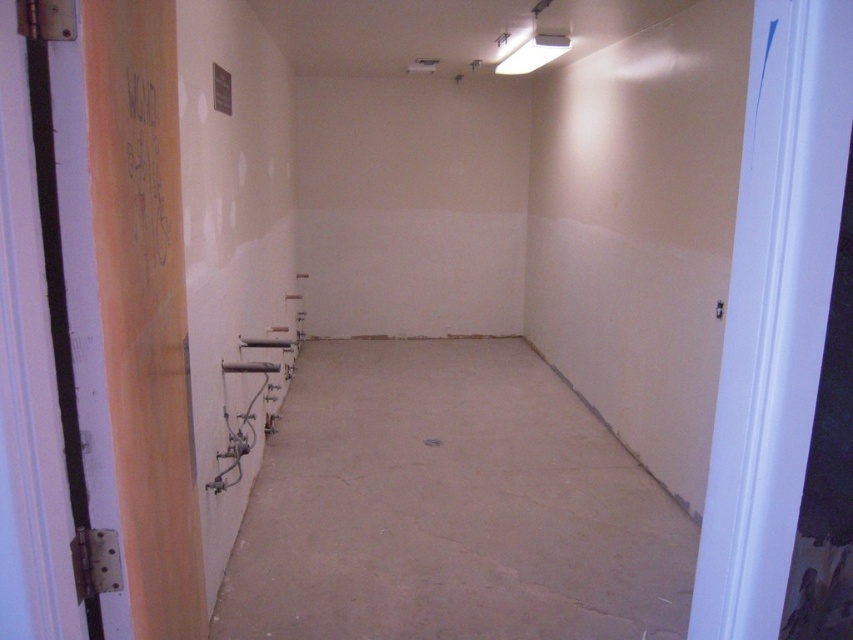
Question: Which object is positioned closest to the orange matte door at left?

Choices:
 (A) smooth concrete floor at center
 (B) white glossy door at right

Answer: (B)

Question: Does white glossy door at right appear on the right side of orange matte door at left?

Choices:
 (A) yes
 (B) no

Answer: (A)

Question: From the image, what is the correct spatial relationship of smooth concrete floor at center in relation to orange matte door at left?

Choices:
 (A) right
 (B) left

Answer: (A)

Question: Which point is closer to the camera?

Choices:
 (A) orange matte door at left
 (B) white glossy door at right

Answer: (B)

Question: Which of the following is the farthest from the observer?

Choices:
 (A) white glossy door at right
 (B) smooth concrete floor at center
 (C) orange matte door at left

Answer: (B)

Question: In this image, where is white glossy door at right located relative to orange matte door at left?

Choices:
 (A) right
 (B) left

Answer: (A)